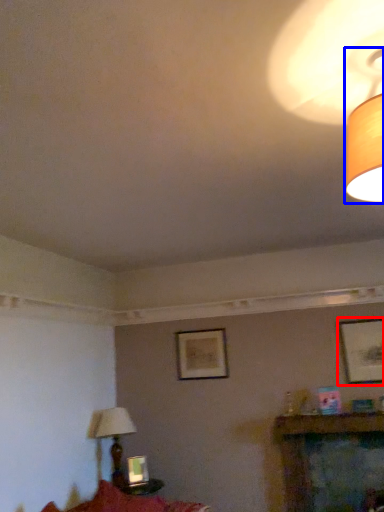
Question: Which object is further to the camera taking this photo, picture frame (highlighted by a red box) or lamp (highlighted by a blue box)?

Choices:
 (A) picture frame
 (B) lamp

Answer: (A)